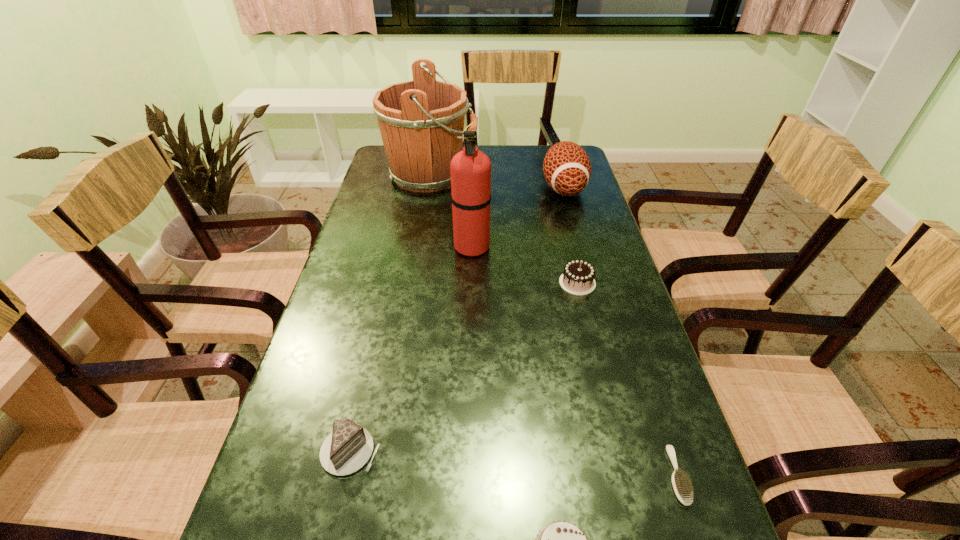
Locate an element on the screen. The image size is (960, 540). vacant area in the image that satisfies the following two spatial constraints: 1. with the handle on the side of the bucket; 2. on the left side of the tallest chocolate cake is located at coordinates (414, 283).

Identify the location of vacant point that satisfies the following two spatial constraints: 1. with the handle on the side of the bucket; 2. on the right side of the rightmost chocolate cake. tap(414, 283).